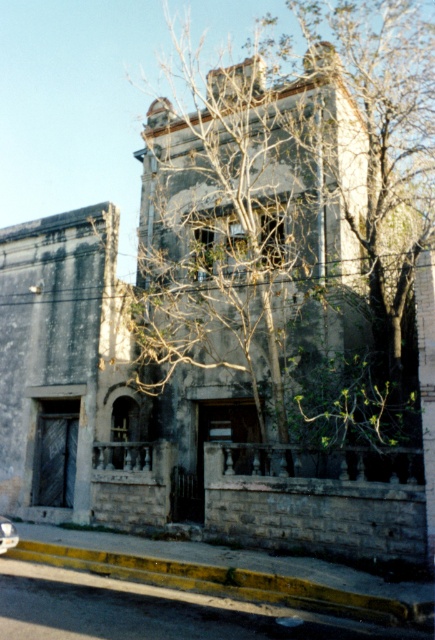
Question: Which of the following is the closest to the observer?

Choices:
 (A) (414, 612)
 (B) (420, 166)

Answer: (A)

Question: Does bare branches at center have a greater width compared to yellow painted concrete curb at lower center?

Choices:
 (A) no
 (B) yes

Answer: (B)

Question: Does bare branches at center appear under yellow painted concrete curb at lower center?

Choices:
 (A) no
 (B) yes

Answer: (A)

Question: Can you confirm if bare branches at center is positioned below yellow painted concrete curb at lower center?

Choices:
 (A) yes
 (B) no

Answer: (B)